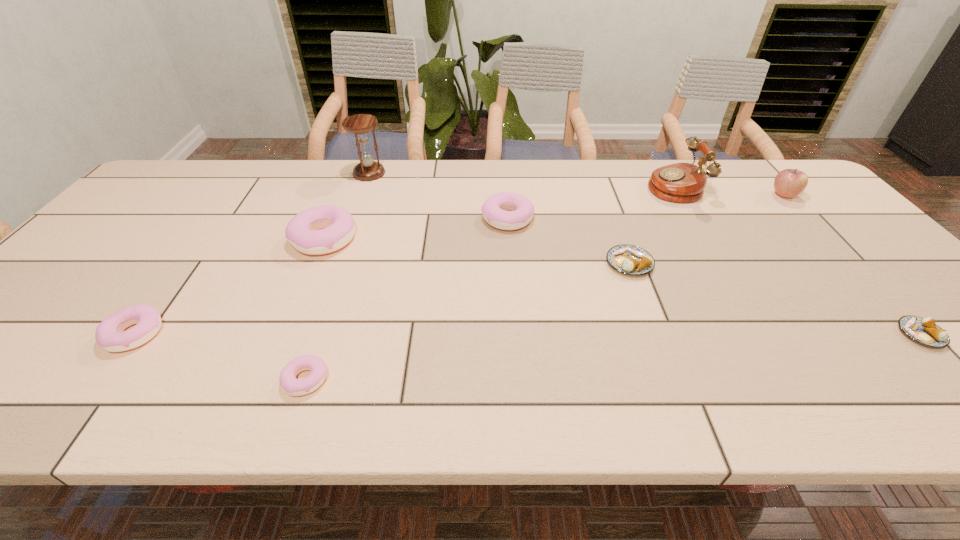
You are a GUI agent. You are given a task and a screenshot of the screen. Output one action in this format:
    pyautogui.click(x=<x>, y=<y>)
    Task: Click on the pastry that stands as the closest to the sixth object from left to right
    
    Given the screenshot: What is the action you would take?
    pyautogui.click(x=521, y=209)

Locate which pastry is the fifth closest to the hourglass. Please provide its 2D coordinates. Your answer should be formatted as a tuple, i.e. [(x, y)], where the tuple contains the x and y coordinates of a point satisfying the conditions above.

[(632, 260)]

Identify which pink pastry is the fourth nearest to the apple. Please provide its 2D coordinates. Your answer should be formatted as a tuple, i.e. [(x, y)], where the tuple contains the x and y coordinates of a point satisfying the conditions above.

[(109, 335)]

Identify which pink pastry is the third closest to the second tallest object. Please provide its 2D coordinates. Your answer should be formatted as a tuple, i.e. [(x, y)], where the tuple contains the x and y coordinates of a point satisfying the conditions above.

[(295, 387)]

Where is `free space that satisfies the following two spatial constraints: 1. on the front side of the second nearest pink pastry; 2. on the left side of the nearest object`? The height and width of the screenshot is (540, 960). free space that satisfies the following two spatial constraints: 1. on the front side of the second nearest pink pastry; 2. on the left side of the nearest object is located at coordinates (102, 380).

Locate an element on the screen. free spot that satisfies the following two spatial constraints: 1. on the dial of the telephone; 2. on the front side of the third smallest pink pastry is located at coordinates (692, 219).